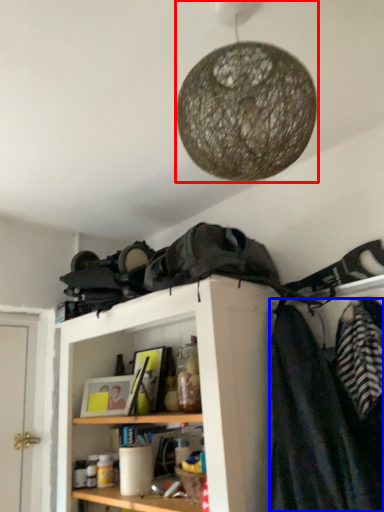
Question: Which object is further to the camera taking this photo, lamp (highlighted by a red box) or clothing (highlighted by a blue box)?

Choices:
 (A) lamp
 (B) clothing

Answer: (B)